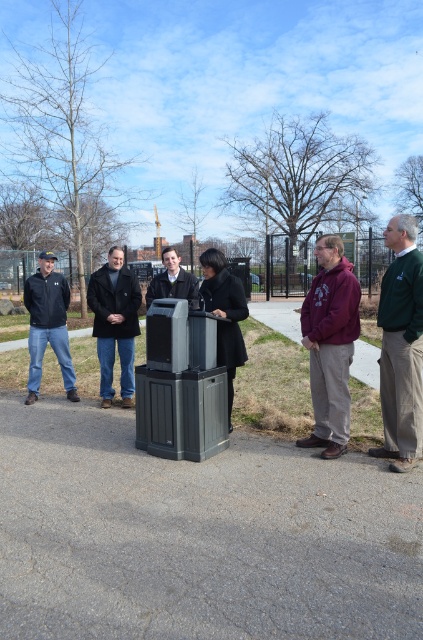
Question: Can you confirm if green fleece jacket at right is smaller than dark blue wool coat at center?

Choices:
 (A) yes
 (B) no

Answer: (A)

Question: Does matte black jacket at left have a greater width compared to dark gray plastic trash can at center?

Choices:
 (A) yes
 (B) no

Answer: (B)

Question: Does dark blue wool coat at center have a smaller size compared to dark gray plastic trash can at center?

Choices:
 (A) no
 (B) yes

Answer: (B)

Question: Among these points, which one is nearest to the camera?

Choices:
 (A) (167, 273)
 (B) (114, 308)
 (C) (338, 282)
 (D) (43, 280)

Answer: (C)

Question: Based on their relative distances, which object is farther from the dark gray plastic trash can at center?

Choices:
 (A) matte black jacket at left
 (B) green fleece jacket at right

Answer: (B)

Question: Which point is farther to the camera?

Choices:
 (A) (321, 420)
 (B) (118, 328)
 (C) (38, 291)

Answer: (C)